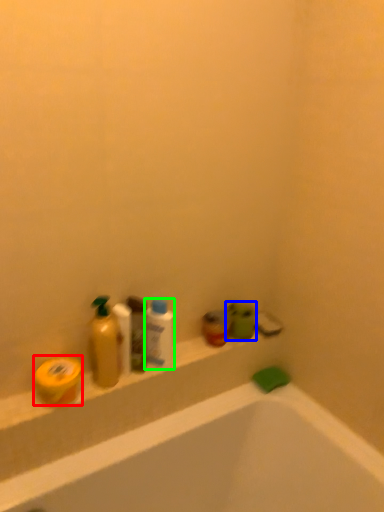
Question: Which is nearer to the soap (highlighted by a red box)? toiletry (highlighted by a blue box) or mouthwash (highlighted by a green box).

Choices:
 (A) toiletry
 (B) mouthwash

Answer: (B)